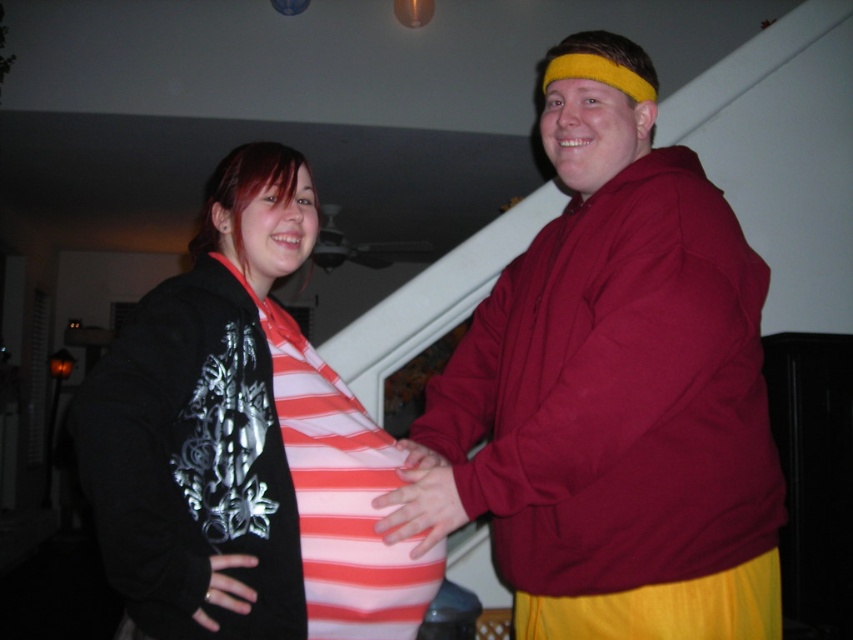
You are designing a clothing catalog and need to place the maroon hoodie at center and striped fabric shirt at center side by side. Based on their sizes, which one should be placed on the left to make the layout look balanced?

The maroon hoodie at center is larger than the striped fabric shirt at center, so placing the larger maroon hoodie at center on the left will create a balanced layout by offsetting its size with its position.

You are standing in the same room as the two people. You need to hand a gift to the person wearing the striped fabric shirt at center without disturbing the man in the maroon hoodie at center. Which direction should you approach from?

You should approach from the left side of the striped fabric shirt at center because the maroon hoodie at center is to the right of it, so approaching from the left avoids the man in the maroon hoodie at center.

You are a photographer adjusting the lighting in the scene. You notice the striped fabric shirt at center and the pink fabric hand at center. Which one is positioned higher in the frame?

The striped fabric shirt at center is located above the pink fabric hand at center, so it is positioned higher in the frame.